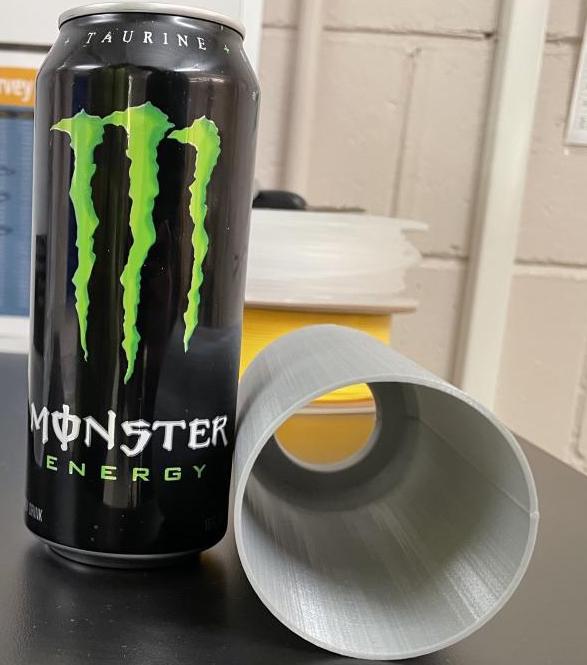
The width and height of the screenshot is (587, 665). I want to click on black tabletop, so click(x=168, y=604).